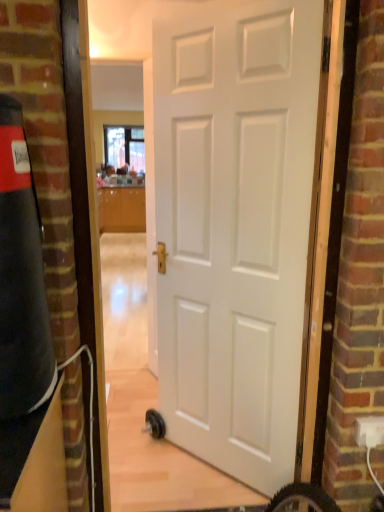
Identify the location of free point to the left of white matte door at center. (150, 470).